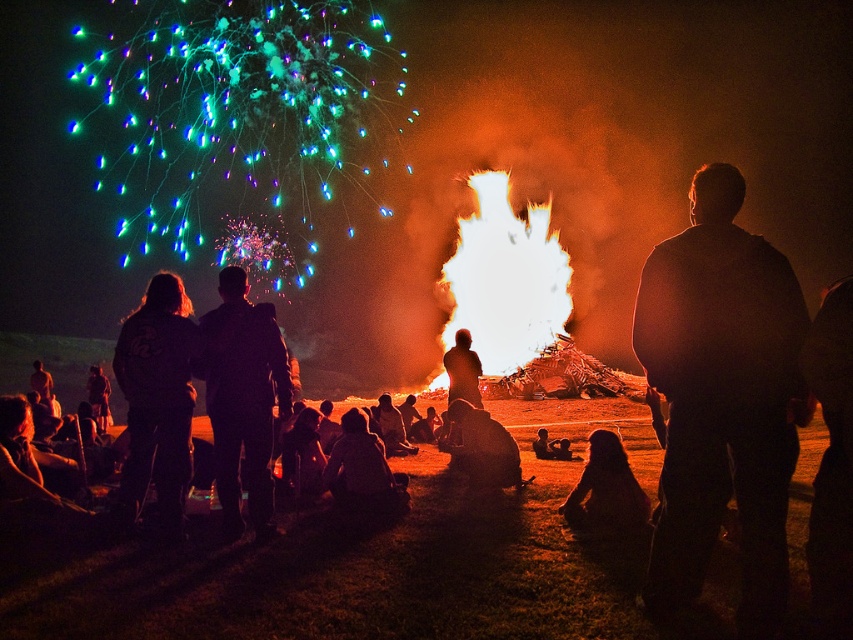
You are a photographer at the event and want to capture a clear shot of the black matte jacket at right and the silhouette figure at center. Since the jacket is taller than the figure, how should you adjust your camera angle to ensure both are fully visible in the frame?

The black matte jacket at right is taller than the silhouette figure at center, so you should angle your camera slightly downward to include the full height of the jacket while still capturing the silhouette figure at center in the frame.

You are standing at the center of the scene and want to pick up the black fabric jacket at left. Which direction should you move to reach it?

The black fabric jacket at left is located at point (157, 401), so you should move to the left and slightly forward to reach it.